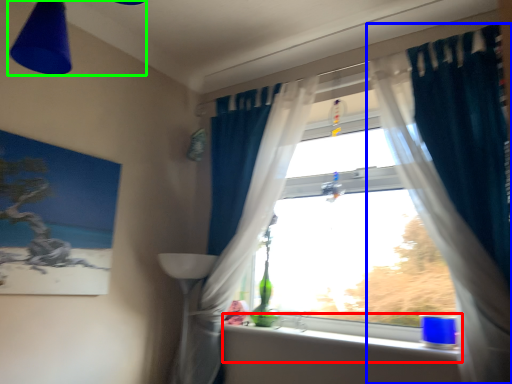
Question: Based on their relative distances, which object is farther from window sill (highlighted by a red box)? Choose from curtain (highlighted by a blue box) and light fixture (highlighted by a green box).

Choices:
 (A) curtain
 (B) light fixture

Answer: (B)